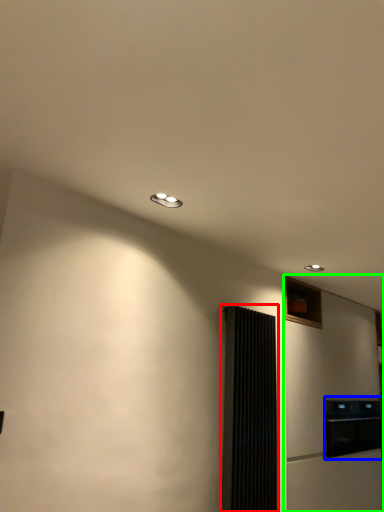
Question: Which object is the closest to the screen door (highlighted by a red box)? Choose among these: appliance (highlighted by a blue box) or fridge (highlighted by a green box).

Choices:
 (A) appliance
 (B) fridge

Answer: (B)